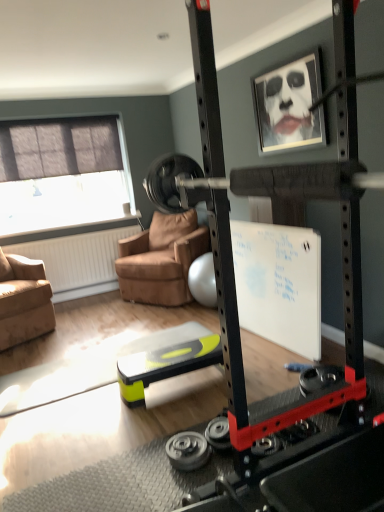
Identify the location of brown leather chair at center, marked as the second chair in a left-to-right arrangement. (161, 259).

Describe the element at coordinates (62, 174) in the screenshot. I see `matte gray window at upper left` at that location.

This screenshot has width=384, height=512. I want to click on suede brown armchair at left, positioned as the 1th chair in left-to-right order, so 23,300.

The height and width of the screenshot is (512, 384). Describe the element at coordinates (188, 451) in the screenshot. I see `black rubber weight at lower center, the 2th wheel from the top` at that location.

Where is `matte black picture frame at upper center`? matte black picture frame at upper center is located at coordinates (289, 105).

From a real-world perspective, is black rubber weight at lower center, which is the 1th wheel in bottom-to-top order, positioned above or below suede brown armchair at left, positioned as the 1th chair in left-to-right order?

black rubber weight at lower center, which is the 1th wheel in bottom-to-top order, is below suede brown armchair at left, positioned as the 1th chair in left-to-right order.

Between point (197, 454) and point (37, 303), which one is positioned in front?

The point (197, 454) is in front.

Is black rubber weight at lower center, which is the 1th wheel in bottom-to-top order, not near suede brown armchair at left, the second chair when ordered from right to left?

Absolutely, black rubber weight at lower center, which is the 1th wheel in bottom-to-top order, is distant from suede brown armchair at left, the second chair when ordered from right to left.

From the image's perspective, is black rubber weight at lower center, the 2th wheel from the top, positioned above or below suede brown armchair at left, the second chair when ordered from right to left?

black rubber weight at lower center, the 2th wheel from the top, is situated lower than suede brown armchair at left, the second chair when ordered from right to left, in the image.

Between point (183, 447) and point (269, 86), which one is positioned behind?

The point (269, 86) is behind.

Does black rubber weight at lower center, the 2th wheel from the top, have a greater width compared to matte black picture frame at upper center?

Indeed, black rubber weight at lower center, the 2th wheel from the top, has a greater width compared to matte black picture frame at upper center.

Which object is positioned more to the right, black rubber weight at lower center, the 2th wheel from the top, or matte black picture frame at upper center?

matte black picture frame at upper center.

Is black rubber weight at lower center, the 2th wheel from the top, facing towards matte black picture frame at upper center?

No, black rubber weight at lower center, the 2th wheel from the top, is not oriented towards matte black picture frame at upper center.

From a real-world perspective, relative to matte black picture frame at upper center, is matte gray window at upper left vertically above or below?

matte gray window at upper left is situated lower than matte black picture frame at upper center in the real world.

Can you confirm if matte gray window at upper left is shorter than matte black picture frame at upper center?

No.

Is matte gray window at upper left not near matte black picture frame at upper center?

That's right, there is a large distance between matte gray window at upper left and matte black picture frame at upper center.

At what (x,y) coordinates should I click in order to perform the action: click on picture frame above the matte gray window at upper left (from the image's perspective). Please return your answer as a coordinate pair (x, y). The width and height of the screenshot is (384, 512). Looking at the image, I should click on (289, 105).

Based on the photo, is brown leather chair at center, marked as the second chair in a left-to-right arrangement, turned away from metallic gray wheel at lower center, marked as the first wheel in a top-to-bottom arrangement?

No, brown leather chair at center, marked as the second chair in a left-to-right arrangement, is not facing away from metallic gray wheel at lower center, marked as the first wheel in a top-to-bottom arrangement.

The image size is (384, 512). I want to click on wheel that is the 2nd one when counting rightward from the brown leather chair at center, the 1th chair viewed from the right, so click(218, 433).

From the picture: From the image's perspective, is brown leather chair at center, the 1th chair viewed from the right, under metallic gray wheel at lower center, arranged as the second wheel when ordered from the bottom?

Actually, brown leather chair at center, the 1th chair viewed from the right, appears above metallic gray wheel at lower center, arranged as the second wheel when ordered from the bottom, in the image.

Is there a large distance between brown leather chair at center, marked as the second chair in a left-to-right arrangement, and metallic gray wheel at lower center, marked as the first wheel in a top-to-bottom arrangement?

That's right, there is a large distance between brown leather chair at center, marked as the second chair in a left-to-right arrangement, and metallic gray wheel at lower center, marked as the first wheel in a top-to-bottom arrangement.

Is suede brown armchair at left, the second chair when ordered from right to left, turned away from matte gray window at upper left?

No.

Considering the sizes of objects suede brown armchair at left, the second chair when ordered from right to left, and matte gray window at upper left in the image provided, who is smaller, suede brown armchair at left, the second chair when ordered from right to left, or matte gray window at upper left?

Smaller between the two is matte gray window at upper left.

From a real-world perspective, is suede brown armchair at left, the second chair when ordered from right to left, physically located above or below matte gray window at upper left?

Clearly, from a real-world perspective, suede brown armchair at left, the second chair when ordered from right to left, is below matte gray window at upper left.

From the image's perspective, is suede brown armchair at left, positioned as the 1th chair in left-to-right order, located beneath matte gray window at upper left?

Indeed, from the image's perspective, suede brown armchair at left, positioned as the 1th chair in left-to-right order, is shown beneath matte gray window at upper left.

Is the position of brown leather chair at center, marked as the second chair in a left-to-right arrangement, more distant than that of matte black picture frame at upper center?

That is True.

Locate an element on the screen. Image resolution: width=384 pixels, height=512 pixels. picture frame in front of the brown leather chair at center, the 1th chair viewed from the right is located at coordinates click(x=289, y=105).

Between brown leather chair at center, marked as the second chair in a left-to-right arrangement, and matte black picture frame at upper center, which one has larger size?

brown leather chair at center, marked as the second chair in a left-to-right arrangement.

Is brown leather chair at center, marked as the second chair in a left-to-right arrangement, located outside matte gray window at upper left?

Yes, brown leather chair at center, marked as the second chair in a left-to-right arrangement, is not within matte gray window at upper left.

Is brown leather chair at center, marked as the second chair in a left-to-right arrangement, aimed at matte gray window at upper left?

No.

Considering the sizes of objects brown leather chair at center, the 1th chair viewed from the right, and matte gray window at upper left in the image provided, who is thinner, brown leather chair at center, the 1th chair viewed from the right, or matte gray window at upper left?

matte gray window at upper left.

How far apart are brown leather chair at center, marked as the second chair in a left-to-right arrangement, and matte gray window at upper left?

1.07 meters.

Locate an element on the screen. chair that is the 2nd one when counting leftward from the black rubber weight at lower center, which is the 1th wheel in bottom-to-top order is located at coordinates (23, 300).

Find the location of a particular element. wheel that is the 2nd object located below the matte black picture frame at upper center (from the image's perspective) is located at coordinates tap(188, 451).

Considering their positions, is black rubber weight at lower center, the 2th wheel from the top, positioned closer to matte black picture frame at upper center than matte gray window at upper left?

Among the two, black rubber weight at lower center, the 2th wheel from the top, is located nearer to matte black picture frame at upper center.

Estimate the real-world distances between objects in this image. Which object is closer to matte gray window at upper left, black rubber weight at lower center, the 2th wheel from the top, or metallic gray wheel at lower center, marked as the first wheel in a top-to-bottom arrangement?

Among the two, black rubber weight at lower center, the 2th wheel from the top, is located nearer to matte gray window at upper left.

Based on their spatial positions, is brown leather chair at center, the 1th chair viewed from the right, or matte gray window at upper left further from metallic gray wheel at lower center, arranged as the second wheel when ordered from the bottom?

Among the two, matte gray window at upper left is located further to metallic gray wheel at lower center, arranged as the second wheel when ordered from the bottom.

Considering their positions, is brown leather chair at center, the 1th chair viewed from the right, positioned closer to matte black picture frame at upper center than black rubber weight at lower center, which is the 1th wheel in bottom-to-top order?

brown leather chair at center, the 1th chair viewed from the right, lies closer to matte black picture frame at upper center than the other object.

Estimate the real-world distances between objects in this image. Which object is further from brown leather chair at center, marked as the second chair in a left-to-right arrangement, black rubber weight at lower center, which is the 1th wheel in bottom-to-top order, or suede brown armchair at left, positioned as the 1th chair in left-to-right order?

Based on the image, black rubber weight at lower center, which is the 1th wheel in bottom-to-top order, appears to be further to brown leather chair at center, marked as the second chair in a left-to-right arrangement.

From the image, which object appears to be farther from matte gray window at upper left, matte black picture frame at upper center or brown leather chair at center, the 1th chair viewed from the right?

matte black picture frame at upper center is further to matte gray window at upper left.

Looking at the image, which one is located further to brown leather chair at center, marked as the second chair in a left-to-right arrangement, matte gray window at upper left or matte black picture frame at upper center?

matte black picture frame at upper center is positioned further to the anchor brown leather chair at center, marked as the second chair in a left-to-right arrangement.

From the image, which object appears to be farther from matte black picture frame at upper center, brown leather chair at center, the 1th chair viewed from the right, or metallic gray wheel at lower center, arranged as the second wheel when ordered from the bottom?

metallic gray wheel at lower center, arranged as the second wheel when ordered from the bottom, lies further to matte black picture frame at upper center than the other object.

Find the location of a particular element. The width and height of the screenshot is (384, 512). chair located between black rubber weight at lower center, the 2th wheel from the top, and brown leather chair at center, marked as the second chair in a left-to-right arrangement, in the depth direction is located at coordinates (23, 300).

Identify the location of chair between matte gray window at upper left and matte black picture frame at upper center from left to right. point(161,259).

Locate an element on the screen. The width and height of the screenshot is (384, 512). chair between suede brown armchair at left, positioned as the 1th chair in left-to-right order, and metallic gray wheel at lower center, marked as the first wheel in a top-to-bottom arrangement is located at coordinates (161, 259).

The height and width of the screenshot is (512, 384). I want to click on picture frame between metallic gray wheel at lower center, marked as the first wheel in a top-to-bottom arrangement, and matte gray window at upper left in the front-back direction, so click(x=289, y=105).